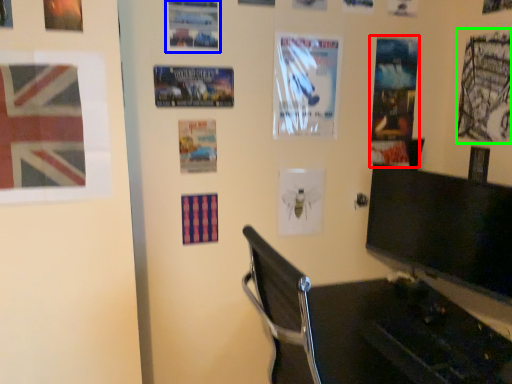
Question: Based on their relative distances, which object is farther from poster page (highlighted by a red box)? Choose from poster (highlighted by a blue box) and poster page (highlighted by a green box).

Choices:
 (A) poster
 (B) poster page

Answer: (A)